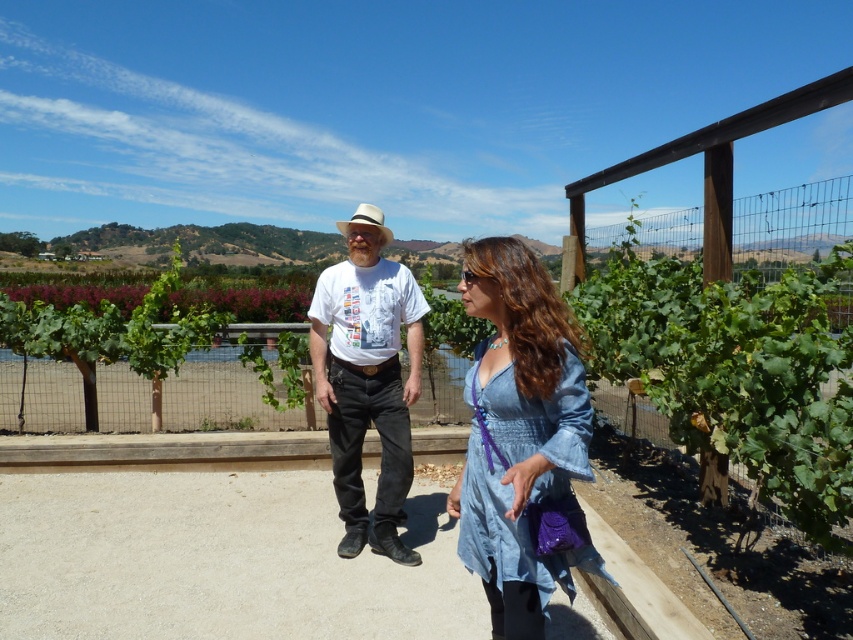
You are standing on the path and want to place a small potted plant between the light gray concrete at center and the denim dress at center. Which object should the plant be closer to?

The light gray concrete at center is closer to you than the denim dress at center, so the plant should be placed closer to the denim dress at center to be between them.

You are standing on the paved pathway and see a point marked at coordinates (519, 433). According to the scene, which object does this point lie on?

The point at coordinates (519, 433) lies on the denim dress at center.